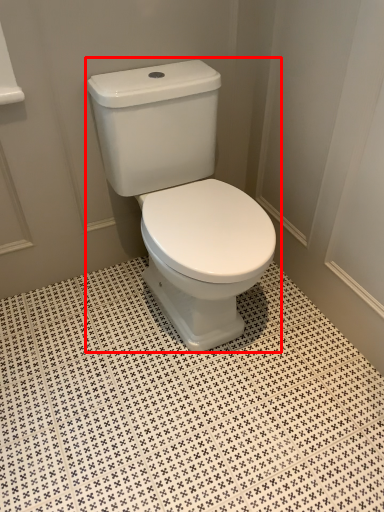
Question: From the image's perspective, where is toilet (annotated by the red box) located relative to ceramic tile?

Choices:
 (A) below
 (B) above

Answer: (B)